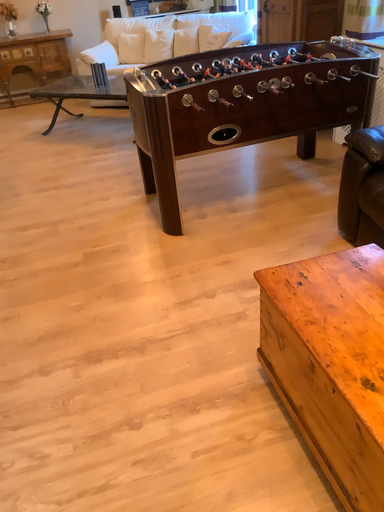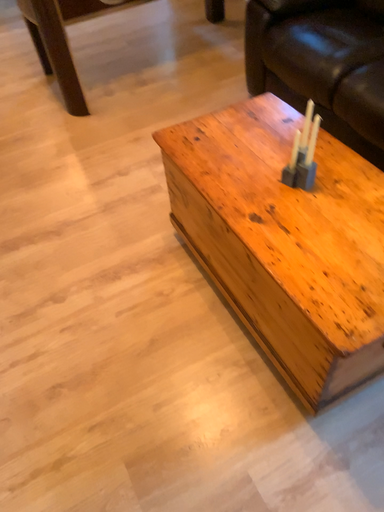
Question: Which way did the camera rotate in the video?

Choices:
 (A) rotated upward
 (B) rotated downward

Answer: (B)